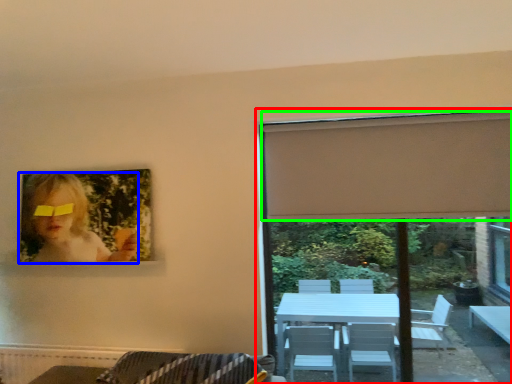
Question: Based on their relative distances, which object is farther from window (highlighted by a red box)? Choose from woman (highlighted by a blue box) and curtain (highlighted by a green box).

Choices:
 (A) woman
 (B) curtain

Answer: (A)